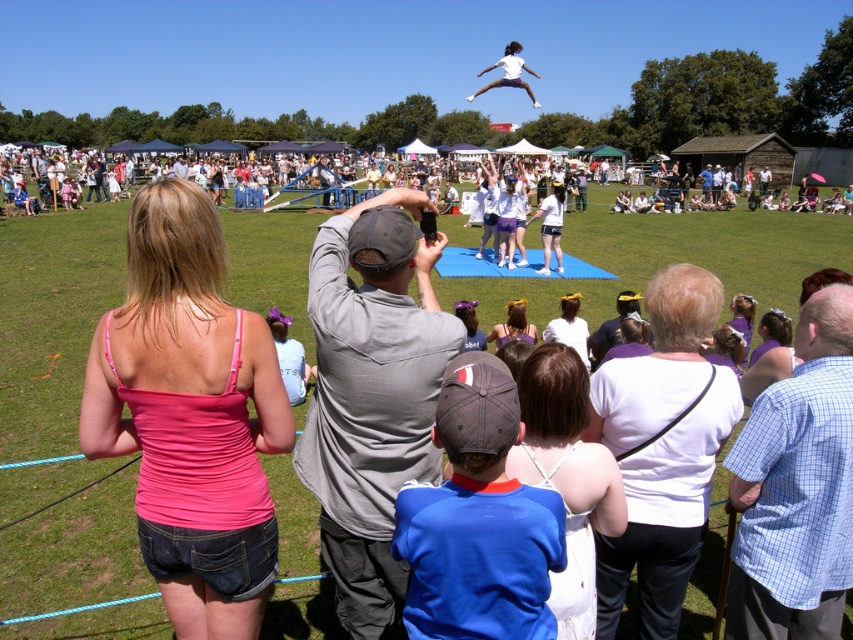
Question: Among these points, which one is farthest from the camera?

Choices:
 (A) (538, 216)
 (B) (463, 324)

Answer: (A)

Question: Can you confirm if dark gray baseball cap at center is bigger than matte purple dress at center?

Choices:
 (A) yes
 (B) no

Answer: (B)

Question: Is white lace dress at center closer to camera compared to white fabric headband at center?

Choices:
 (A) yes
 (B) no

Answer: (A)

Question: In this image, where is white fabric at center located relative to purple fabric at lower right?

Choices:
 (A) below
 (B) above

Answer: (A)

Question: Which of the following is the farthest from the observer?

Choices:
 (A) white lace dress at center
 (B) white fabric headband at center
 (C) gray cotton shirt at center
 (D) dark gray baseball cap at center

Answer: (B)

Question: Which point appears farthest from the camera in this image?

Choices:
 (A) (693, 284)
 (B) (793, 401)
 (C) (409, 372)

Answer: (A)